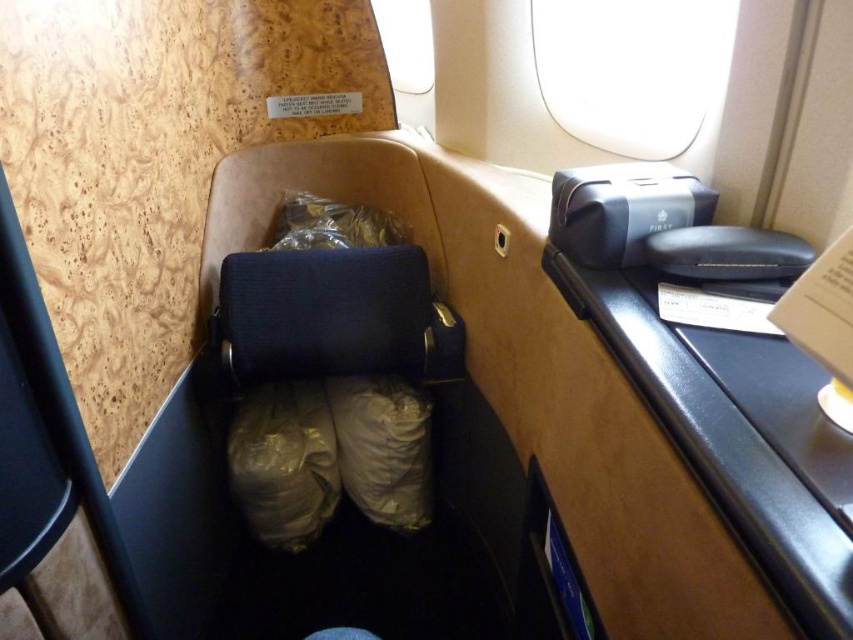
Based on the photo, can you confirm if shiny plastic bag at center is positioned above matte beige bag at center?

Actually, shiny plastic bag at center is below matte beige bag at center.

From the picture: Is shiny plastic bag at center to the right of matte beige bag at center from the viewer's perspective?

Incorrect, shiny plastic bag at center is not on the right side of matte beige bag at center.

Find the location of `shiny plastic bag at center`. shiny plastic bag at center is located at coordinates (283, 461).

This screenshot has width=853, height=640. What do you see at coordinates (283, 461) in the screenshot? I see `shiny plastic bag at center` at bounding box center [283, 461].

Who is lower down, shiny plastic bag at center or shiny gold bag at center?

shiny plastic bag at center

Is point (283, 492) positioned after point (312, 236)?

No, (283, 492) is in front of (312, 236).

Find the location of a particular element. The height and width of the screenshot is (640, 853). shiny plastic bag at center is located at coordinates (283, 461).

Can you confirm if matte beige bag at center is positioned to the right of shiny gold bag at center?

Indeed, matte beige bag at center is positioned on the right side of shiny gold bag at center.

Does matte beige bag at center appear under shiny gold bag at center?

Yes.

Does point (352, 456) come in front of point (320, 220)?

Yes.

This screenshot has width=853, height=640. What are the coordinates of `matte beige bag at center` in the screenshot? It's located at (383, 448).